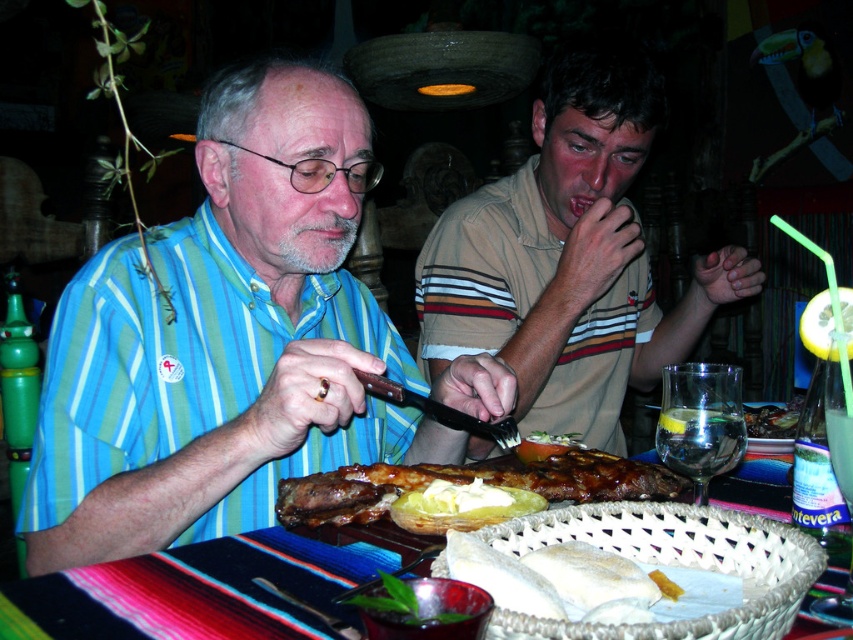
Between point (346, 202) and point (618, 182), which one is positioned in front?

Point (346, 202) is more forward.

Which of these two, blue striped shirt at center or brown striped shirt at center, stands taller?

With more height is brown striped shirt at center.

Locate an element on the screen. The width and height of the screenshot is (853, 640). blue striped shirt at center is located at coordinates (224, 340).

Which is below, brown striped shirt at center or yellow buttery potato at center?

yellow buttery potato at center is lower down.

Is brown striped shirt at center wider than yellow buttery potato at center?

Yes.

This screenshot has height=640, width=853. What do you see at coordinates (569, 259) in the screenshot? I see `brown striped shirt at center` at bounding box center [569, 259].

Find the location of a particular element. This screenshot has height=640, width=853. brown striped shirt at center is located at coordinates (569, 259).

Can you confirm if wooden table at center is thinner than white doughy bread at center?

No, wooden table at center is not thinner than white doughy bread at center.

How distant is wooden table at center from white doughy bread at center?

The distance of wooden table at center from white doughy bread at center is 7.62 inches.

Who is more forward, (256, 628) or (517, 580)?

Point (517, 580) is more forward.

I want to click on wooden table at center, so click(193, 593).